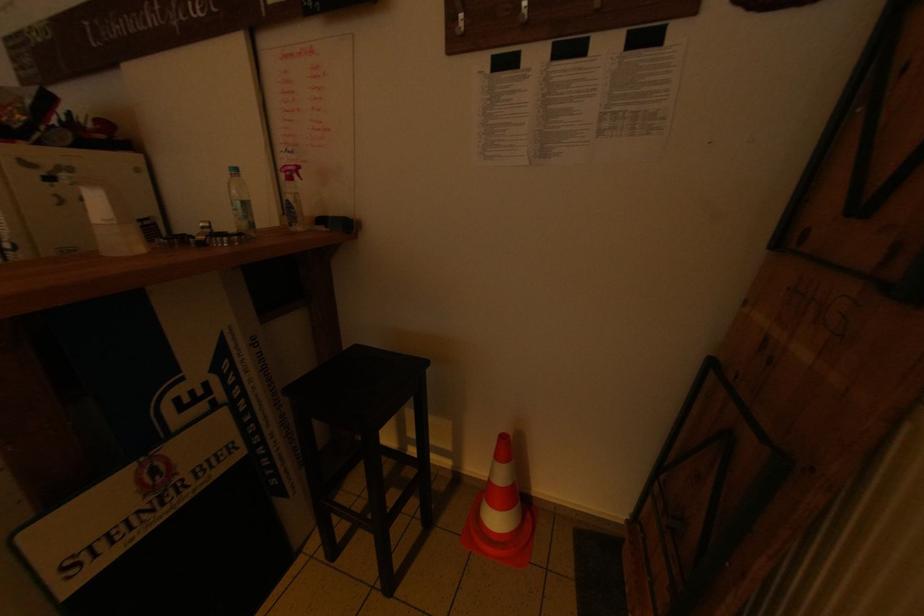
Identify the location of spray bottle trigger. Image resolution: width=924 pixels, height=616 pixels. (293, 207).